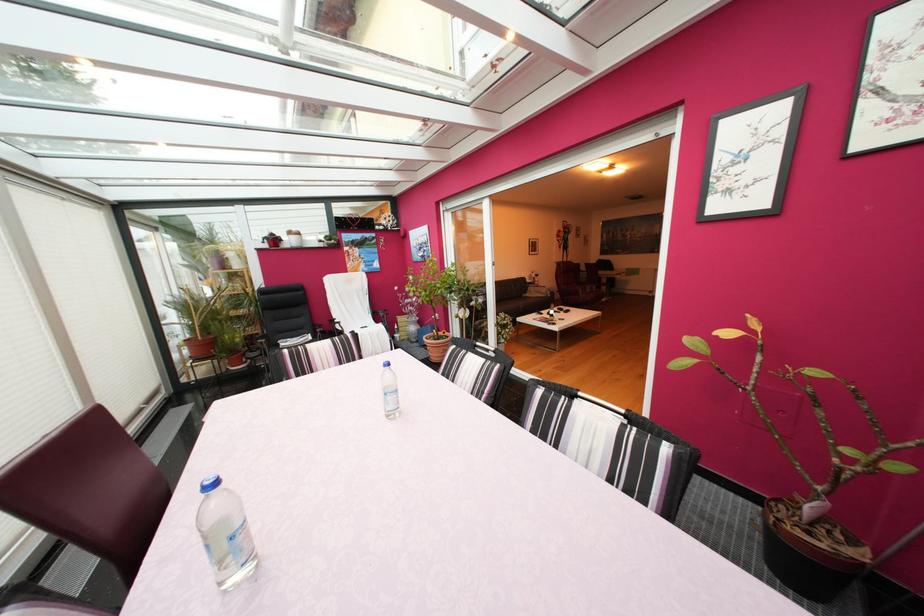
This screenshot has width=924, height=616. Describe the element at coordinates (381, 315) in the screenshot. I see `the chair armrest` at that location.